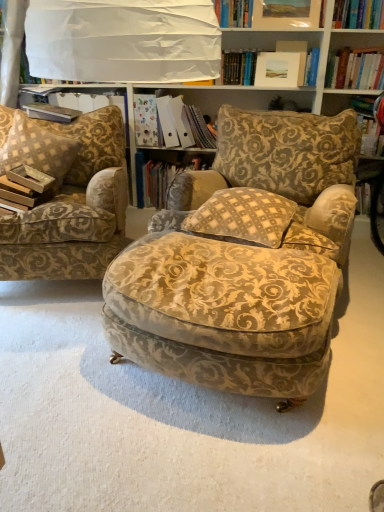
Question: From the image's perspective, does beige checkered pillow at center, the first pillow when ordered from right to left, appear higher than hardcover book at upper left?

Choices:
 (A) yes
 (B) no

Answer: (B)

Question: Is beige checkered pillow at center, the first pillow when ordered from right to left, positioned far away from hardcover book at upper left?

Choices:
 (A) no
 (B) yes

Answer: (B)

Question: Does beige checkered pillow at center, the second pillow in the back-to-front sequence, have a smaller size compared to hardcover book at upper left?

Choices:
 (A) no
 (B) yes

Answer: (A)

Question: Would you say beige checkered pillow at center, the first pillow when ordered from right to left, is outside hardcover book at upper left?

Choices:
 (A) no
 (B) yes

Answer: (B)

Question: From a real-world perspective, is beige checkered pillow at center, the second pillow in the back-to-front sequence, positioned under hardcover book at upper left based on gravity?

Choices:
 (A) yes
 (B) no

Answer: (A)

Question: From a real-world perspective, is gold-patterned fabric armchair at left, placed as the 1th chair when sorted from left to right, positioned above or below matte white picture frame at upper center?

Choices:
 (A) below
 (B) above

Answer: (A)

Question: Is gold-patterned fabric armchair at left, positioned as the 2th chair in right-to-left order, bigger or smaller than matte white picture frame at upper center?

Choices:
 (A) big
 (B) small

Answer: (A)

Question: Is gold-patterned fabric armchair at left, placed as the 1th chair when sorted from left to right, to the left or to the right of matte white picture frame at upper center in the image?

Choices:
 (A) left
 (B) right

Answer: (A)

Question: Considering the positions of point (29, 269) and point (279, 74), is point (29, 269) closer or farther from the camera than point (279, 74)?

Choices:
 (A) farther
 (B) closer

Answer: (B)

Question: Which is correct: beige checkered pillow at center, the first pillow when ordered from right to left, is inside hardcover book at center, which is counted as the 1th book, starting from the bottom, or outside of it?

Choices:
 (A) outside
 (B) inside

Answer: (A)

Question: Looking at the image, does beige checkered pillow at center, the 2th pillow viewed from the left, seem bigger or smaller compared to hardcover book at center, positioned as the 2th book in top-to-bottom order?

Choices:
 (A) small
 (B) big

Answer: (A)

Question: From the image's perspective, relative to hardcover book at center, which is counted as the 1th book, starting from the bottom, is beige checkered pillow at center, the 2th pillow viewed from the left, above or below?

Choices:
 (A) above
 (B) below

Answer: (B)

Question: From a real-world perspective, is beige checkered pillow at center, the 1th pillow when ordered from front to back, positioned above or below hardcover book at center, which is counted as the 1th book, starting from the bottom?

Choices:
 (A) above
 (B) below

Answer: (A)

Question: In terms of size, does velvet gold-patterned ottoman at center, the 2th chair viewed from the left, appear bigger or smaller than gold-patterned fabric armchair at left, positioned as the 2th chair in right-to-left order?

Choices:
 (A) big
 (B) small

Answer: (B)

Question: Looking at their shapes, would you say velvet gold-patterned ottoman at center, the 2th chair viewed from the left, is wider or thinner than gold-patterned fabric armchair at left, positioned as the 2th chair in right-to-left order?

Choices:
 (A) wide
 (B) thin

Answer: (B)